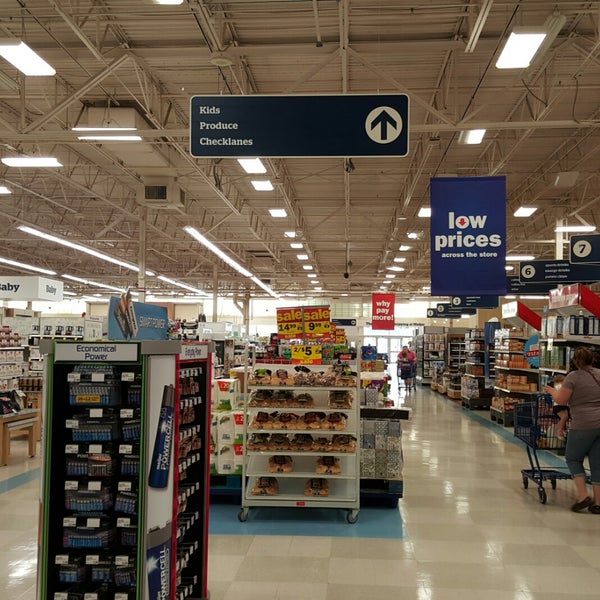
I want to click on the front door, so click(393, 349).